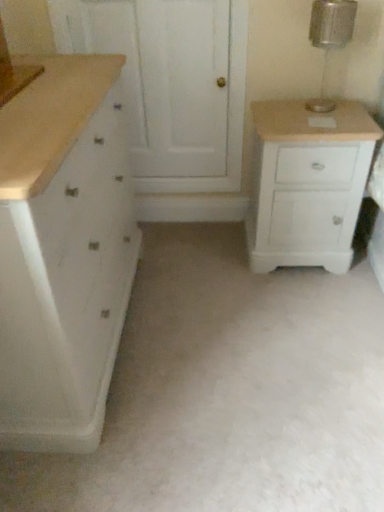
Find the location of a particular element. white wood screen door at upper center is located at coordinates (171, 83).

At what (x,y) coordinates should I click in order to perform the action: click on white wood screen door at upper center. Please return your answer as a coordinate pair (x, y). Image resolution: width=384 pixels, height=512 pixels. Looking at the image, I should click on (171, 83).

From a real-world perspective, is metallic glass lamp at upper right under white painted wood cabinet at right, which is the first chest of drawers in right-to-left order?

No, from a real-world perspective, metallic glass lamp at upper right is not beneath white painted wood cabinet at right, which is the first chest of drawers in right-to-left order.

Identify the location of the 1st chest of drawers counting from the left of the metallic glass lamp at upper right. The image size is (384, 512). (307, 184).

Does metallic glass lamp at upper right have a greater height compared to white wood screen door at upper center?

Incorrect, the height of metallic glass lamp at upper right is not larger of that of white wood screen door at upper center.

Is metallic glass lamp at upper right completely or partially outside of white wood screen door at upper center?

Yes, metallic glass lamp at upper right is located beyond the bounds of white wood screen door at upper center.

How many degrees apart are the facing directions of metallic glass lamp at upper right and white wood screen door at upper center?

1.04 degrees.

From a real-world perspective, is white matte chest of drawers at left, which is the first chest of drawers from left to right, above or below white painted wood cabinet at right, which is the first chest of drawers in right-to-left order?

In terms of real-world spatial position, white matte chest of drawers at left, which is the first chest of drawers from left to right, is above white painted wood cabinet at right, which is the first chest of drawers in right-to-left order.

Is white matte chest of drawers at left, which is the first chest of drawers from left to right, shorter than white painted wood cabinet at right, the 2th chest of drawers positioned from the left?

No, white matte chest of drawers at left, which is the first chest of drawers from left to right, is not shorter than white painted wood cabinet at right, the 2th chest of drawers positioned from the left.

Is white matte chest of drawers at left, which is the first chest of drawers from left to right, in contact with white painted wood cabinet at right, which is the first chest of drawers in right-to-left order?

No, white matte chest of drawers at left, which is the first chest of drawers from left to right, is not with white painted wood cabinet at right, which is the first chest of drawers in right-to-left order.

Is point (17, 133) more distant than point (283, 166)?

No, (17, 133) is in front of (283, 166).

Which is closer, (6, 353) or (312, 15)?

The point (6, 353) is in front.

Is white matte chest of drawers at left, which is the first chest of drawers from left to right, facing towards metallic glass lamp at upper right?

Yes.

Is white matte chest of drawers at left, which is the first chest of drawers from left to right, bigger than metallic glass lamp at upper right?

Yes.

Which of these two, white matte chest of drawers at left, which is the first chest of drawers from left to right, or metallic glass lamp at upper right, stands taller?

white matte chest of drawers at left, which is the first chest of drawers from left to right, is taller.

Considering the positions of objects white painted wood cabinet at right, which is the first chest of drawers in right-to-left order, and white matte chest of drawers at left, the 2th chest of drawers when ordered from right to left, in the image provided, who is in front, white painted wood cabinet at right, which is the first chest of drawers in right-to-left order, or white matte chest of drawers at left, the 2th chest of drawers when ordered from right to left,?

Positioned in front is white matte chest of drawers at left, the 2th chest of drawers when ordered from right to left.

Does white painted wood cabinet at right, which is the first chest of drawers in right-to-left order, have a greater height compared to white matte chest of drawers at left, the 2th chest of drawers when ordered from right to left?

In fact, white painted wood cabinet at right, which is the first chest of drawers in right-to-left order, may be shorter than white matte chest of drawers at left, the 2th chest of drawers when ordered from right to left.

From the image's perspective, which is above, white painted wood cabinet at right, the 2th chest of drawers positioned from the left, or white matte chest of drawers at left, which is the first chest of drawers from left to right?

white painted wood cabinet at right, the 2th chest of drawers positioned from the left, is shown above in the image.

Is white painted wood cabinet at right, which is the first chest of drawers in right-to-left order, inside the boundaries of white matte chest of drawers at left, which is the first chest of drawers from left to right, or outside?

The correct answer is: outside.

Who is smaller, white wood screen door at upper center or white painted wood cabinet at right, the 2th chest of drawers positioned from the left?

Smaller between the two is white wood screen door at upper center.

Where is `screen door on the left side of white painted wood cabinet at right, the 2th chest of drawers positioned from the left`? screen door on the left side of white painted wood cabinet at right, the 2th chest of drawers positioned from the left is located at coordinates (171, 83).

Is white wood screen door at upper center inside the boundaries of white painted wood cabinet at right, the 2th chest of drawers positioned from the left, or outside?

white wood screen door at upper center exists outside the volume of white painted wood cabinet at right, the 2th chest of drawers positioned from the left.

Considering the sizes of white wood screen door at upper center and white painted wood cabinet at right, the 2th chest of drawers positioned from the left, in the image, is white wood screen door at upper center taller or shorter than white painted wood cabinet at right, the 2th chest of drawers positioned from the left,?

Considering their sizes, white wood screen door at upper center has more height than white painted wood cabinet at right, the 2th chest of drawers positioned from the left.

From a real-world perspective, between white painted wood cabinet at right, the 2th chest of drawers positioned from the left, and metallic glass lamp at upper right, who is vertically lower?

white painted wood cabinet at right, the 2th chest of drawers positioned from the left, is physically lower.

Considering the positions of objects white painted wood cabinet at right, which is the first chest of drawers in right-to-left order, and metallic glass lamp at upper right in the image provided, who is in front, white painted wood cabinet at right, which is the first chest of drawers in right-to-left order, or metallic glass lamp at upper right?

metallic glass lamp at upper right.

Does white painted wood cabinet at right, which is the first chest of drawers in right-to-left order, have a lesser width compared to metallic glass lamp at upper right?

In fact, white painted wood cabinet at right, which is the first chest of drawers in right-to-left order, might be wider than metallic glass lamp at upper right.

Could metallic glass lamp at upper right be considered to be inside white painted wood cabinet at right, which is the first chest of drawers in right-to-left order?

No, metallic glass lamp at upper right is located outside of white painted wood cabinet at right, which is the first chest of drawers in right-to-left order.

Image resolution: width=384 pixels, height=512 pixels. I want to click on lamp that appears on the right of white painted wood cabinet at right, which is the first chest of drawers in right-to-left order, so click(330, 38).

At what (x,y) coordinates should I click in order to perform the action: click on lamp in front of the white wood screen door at upper center. Please return your answer as a coordinate pair (x, y). This screenshot has width=384, height=512. Looking at the image, I should click on (330, 38).

Consider the image. Considering their positions, is white painted wood cabinet at right, the 2th chest of drawers positioned from the left, positioned further to metallic glass lamp at upper right than white wood screen door at upper center?

The object further to metallic glass lamp at upper right is white wood screen door at upper center.

Looking at the image, which one is located closer to white painted wood cabinet at right, the 2th chest of drawers positioned from the left, white matte chest of drawers at left, the 2th chest of drawers when ordered from right to left, or white wood screen door at upper center?

The object closer to white painted wood cabinet at right, the 2th chest of drawers positioned from the left, is white wood screen door at upper center.

Which object lies further to the anchor point white painted wood cabinet at right, which is the first chest of drawers in right-to-left order, white wood screen door at upper center or metallic glass lamp at upper right?

white wood screen door at upper center.

Which object lies nearer to the anchor point white painted wood cabinet at right, the 2th chest of drawers positioned from the left, white matte chest of drawers at left, which is the first chest of drawers from left to right, or metallic glass lamp at upper right?

metallic glass lamp at upper right lies closer to white painted wood cabinet at right, the 2th chest of drawers positioned from the left, than the other object.

Looking at the image, which one is located closer to metallic glass lamp at upper right, white painted wood cabinet at right, the 2th chest of drawers positioned from the left, or white matte chest of drawers at left, which is the first chest of drawers from left to right?

white painted wood cabinet at right, the 2th chest of drawers positioned from the left, is positioned closer to the anchor metallic glass lamp at upper right.

Considering their positions, is white painted wood cabinet at right, the 2th chest of drawers positioned from the left, positioned further to white wood screen door at upper center than metallic glass lamp at upper right?

metallic glass lamp at upper right is further to white wood screen door at upper center.

Looking at the image, which one is located further to white wood screen door at upper center, white matte chest of drawers at left, which is the first chest of drawers from left to right, or metallic glass lamp at upper right?

Answer: Based on the image, white matte chest of drawers at left, which is the first chest of drawers from left to right, appears to be further to white wood screen door at upper center.

Looking at the image, which one is located further to white matte chest of drawers at left, which is the first chest of drawers from left to right, white wood screen door at upper center or metallic glass lamp at upper right?

metallic glass lamp at upper right is positioned further to the anchor white matte chest of drawers at left, which is the first chest of drawers from left to right.

The height and width of the screenshot is (512, 384). Identify the location of screen door between white matte chest of drawers at left, the 2th chest of drawers when ordered from right to left, and metallic glass lamp at upper right. (171, 83).

Where is `the chest of drawers located between white matte chest of drawers at left, which is the first chest of drawers from left to right, and white wood screen door at upper center in the depth direction`? Image resolution: width=384 pixels, height=512 pixels. the chest of drawers located between white matte chest of drawers at left, which is the first chest of drawers from left to right, and white wood screen door at upper center in the depth direction is located at coordinates (307, 184).

Identify the location of the chest of drawers located between white wood screen door at upper center and metallic glass lamp at upper right in the left-right direction. (307, 184).

Locate an element on the screen. the chest of drawers situated between white matte chest of drawers at left, which is the first chest of drawers from left to right, and metallic glass lamp at upper right from left to right is located at coordinates (307, 184).